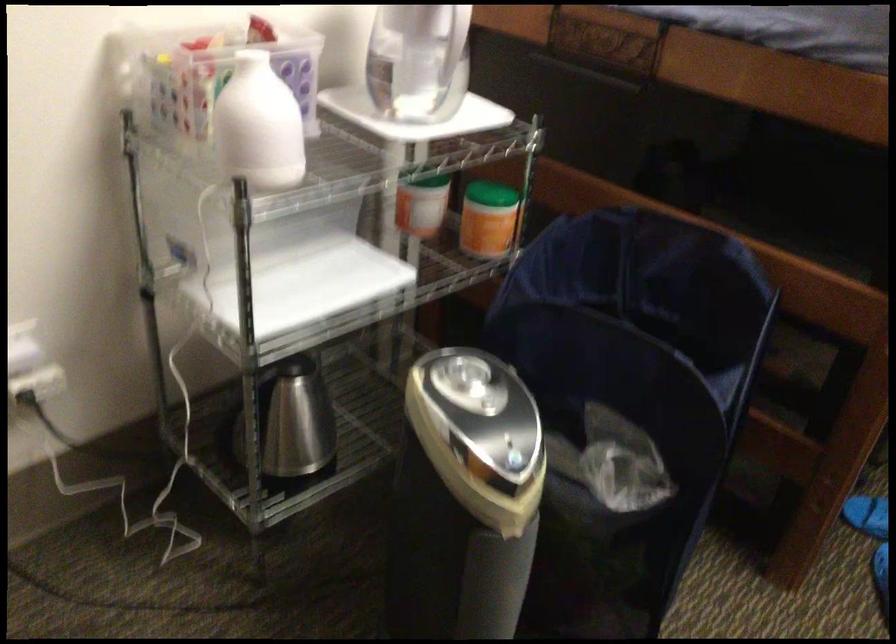
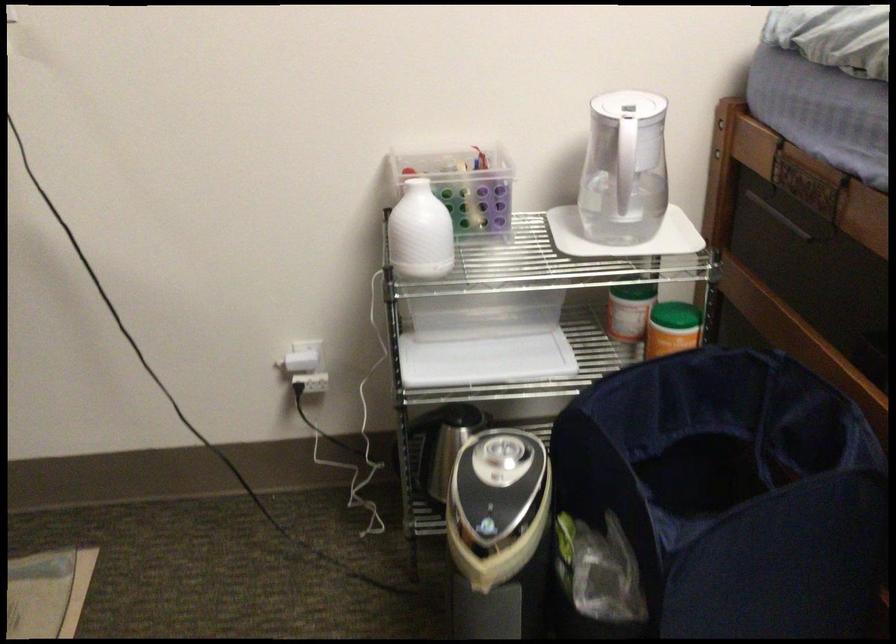
Locate, in the second image, the point that corresponds to pixel 288 126 in the first image.

(419, 232)